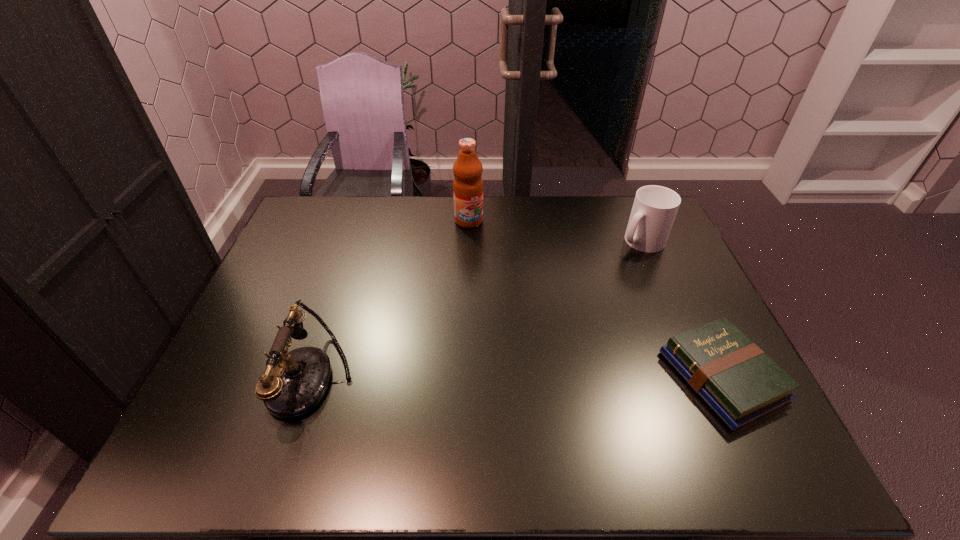
I want to click on telephone, so click(x=293, y=385).

Locate an element on the screen. book is located at coordinates (741, 384).

I want to click on mug, so click(654, 209).

The height and width of the screenshot is (540, 960). I want to click on the tallest object, so click(468, 185).

Where is `fruit juice`? The width and height of the screenshot is (960, 540). fruit juice is located at coordinates (468, 185).

I want to click on vacant space situated 0.120m on the dial of the telephone, so click(x=224, y=378).

Identify the location of free space located 0.150m on the dial of the telephone. The image size is (960, 540). (211, 378).

Identify the location of free space located 0.330m on the back of the shortest object. This screenshot has height=540, width=960. (662, 251).

This screenshot has height=540, width=960. Find the location of `free space located 0.290m on the handle side of the mug`. free space located 0.290m on the handle side of the mug is located at coordinates (583, 301).

Image resolution: width=960 pixels, height=540 pixels. Find the location of `vacant position located 0.150m on the handle side of the mug`. vacant position located 0.150m on the handle side of the mug is located at coordinates (607, 276).